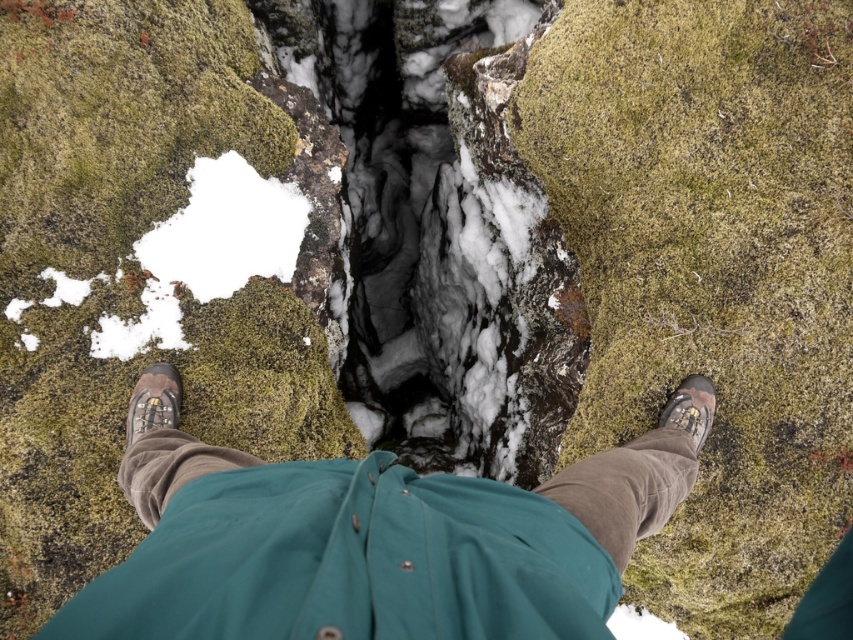
You are a hiker who just spotted your boots and a shoe in the crevice. Which object is closer to you, the brown suede boots at center or the brown suede shoe at lower right?

The brown suede boots at center is positioned under the brown suede shoe at lower right, so the brown suede shoe at lower right is closer to you.

You are a hiker standing at the edge of a crevice. You see your brown suede boots at center and a brown suede shoe at lower right. Which one is closer to you?

The brown suede boots at center is closer to you because it is in front of the brown suede shoe at lower right.